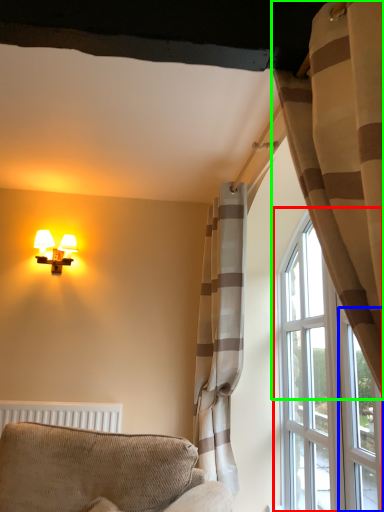
Question: Considering the real-world distances, which object is farthest from window (highlighted by a red box)? glass door (highlighted by a blue box) or curtain (highlighted by a green box)?

Choices:
 (A) glass door
 (B) curtain

Answer: (B)